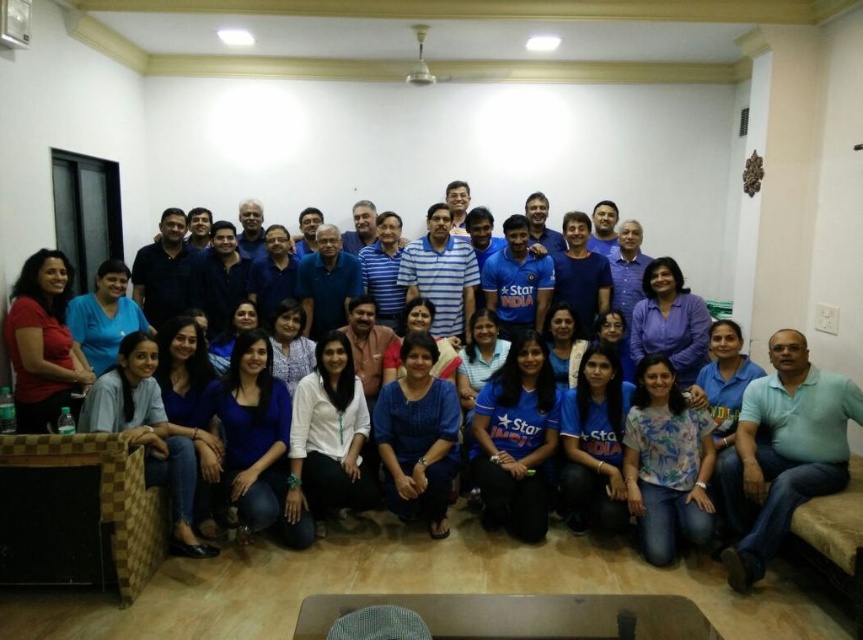
Looking at this image, between light blue cotton shirt at lower right and matte red shirt at lower left, which one has less height?

matte red shirt at lower left is shorter.

Is point (843, 401) closer to viewer compared to point (11, 340)?

Yes.

Who is more forward, (761, 531) or (39, 291)?

Point (761, 531)

This screenshot has height=640, width=863. In order to click on light blue cotton shirt at lower right in this screenshot , I will do `click(782, 452)`.